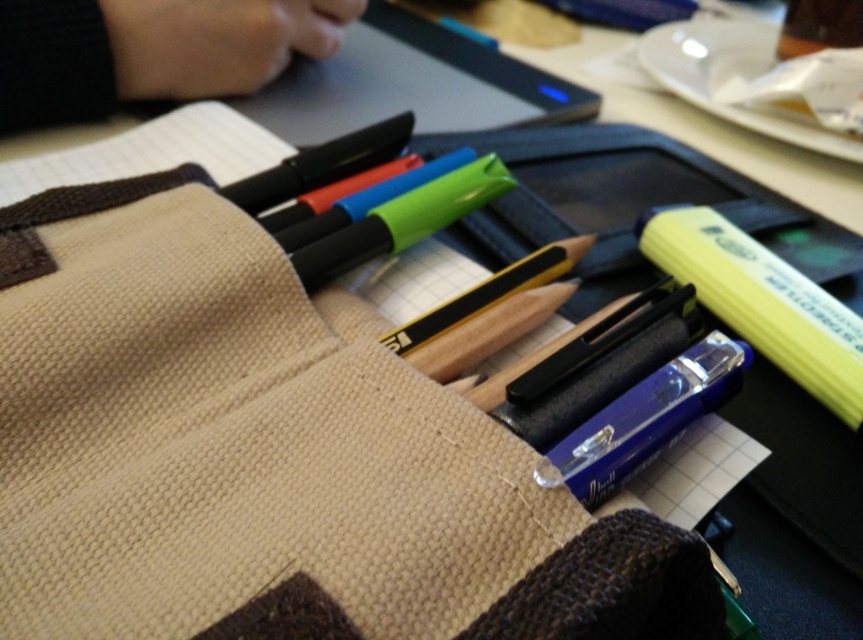
Question: Which point is closer to the camera?

Choices:
 (A) (471, 36)
 (B) (619, 460)
 (C) (228, 16)

Answer: (B)

Question: Considering the relative positions of yellow matte highlighter at right and matte black pencil at center in the image provided, where is yellow matte highlighter at right located with respect to matte black pencil at center?

Choices:
 (A) above
 (B) below

Answer: (B)

Question: Among these points, which one is farthest from the camera?

Choices:
 (A) (704, 291)
 (B) (401, 337)
 (C) (413, 232)

Answer: (A)

Question: Among these points, which one is nearest to the camera?

Choices:
 (A) (502, 282)
 (B) (451, 28)
 (C) (819, 384)
 (D) (10, 122)

Answer: (A)

Question: Can you confirm if black fabric hand at upper left is positioned above matte blue highlighter at upper center?

Choices:
 (A) yes
 (B) no

Answer: (B)

Question: Is black fabric hand at upper left positioned behind yellow matte highlighter at right?

Choices:
 (A) no
 (B) yes

Answer: (B)